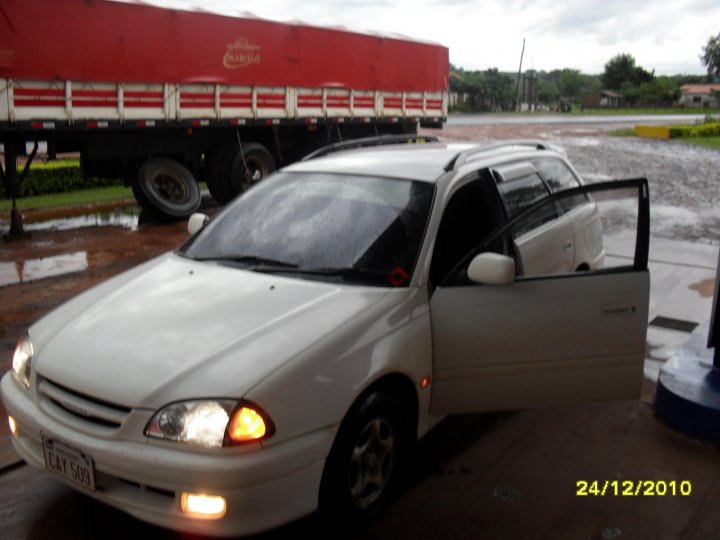
At what (x,y) coordinates should I click in order to perform the action: click on hood. Please return your answer as a coordinate pair (x, y). Looking at the image, I should click on (171, 315).